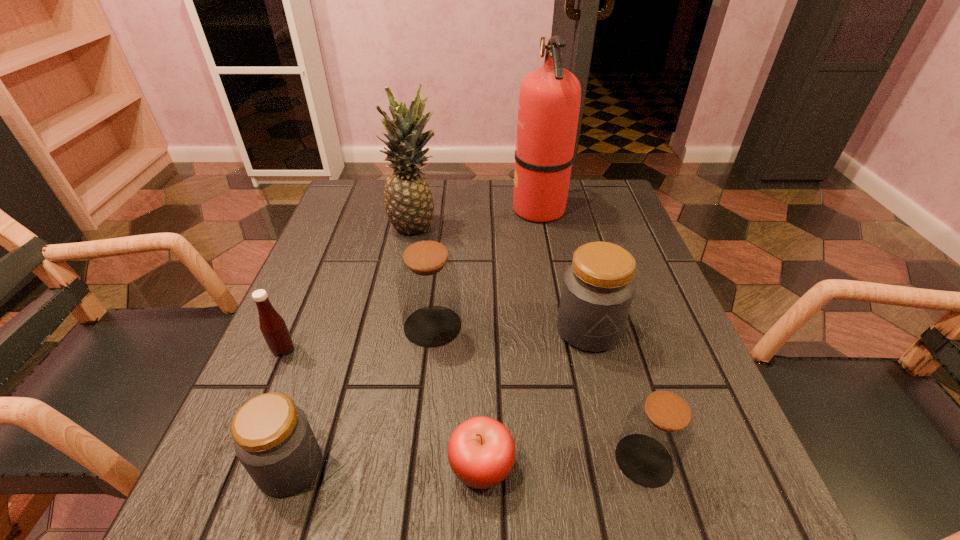
Identify the location of vacant space at the near left corner of the desktop. This screenshot has height=540, width=960. (233, 531).

In the image, there is a desktop. Where is `vacant area at the far right corner`? vacant area at the far right corner is located at coordinates (613, 206).

Image resolution: width=960 pixels, height=540 pixels. Find the location of `free space at the near right corner of the desktop`. free space at the near right corner of the desktop is located at coordinates (753, 509).

Identify the location of unoccupied area between the green pineapple and the right brown jar. The width and height of the screenshot is (960, 540). (530, 342).

You are a GUI agent. You are given a task and a screenshot of the screen. Output one action in this format:
    pyautogui.click(x=<x>, y=<y>)
    Task: Click on the free area in between the apple and the right gray jar
    Image resolution: width=960 pixels, height=540 pixels.
    Given the screenshot: What is the action you would take?
    pyautogui.click(x=535, y=398)

Image resolution: width=960 pixels, height=540 pixels. I want to click on vacant space in between the red apple and the pineapple, so click(x=448, y=346).

Identify the location of free space between the pineapple and the shortest object. This screenshot has width=960, height=540. (448, 346).

You are a GUI agent. You are given a task and a screenshot of the screen. Output one action in this format:
    pyautogui.click(x=<x>, y=<y>)
    Task: Click on the empty location between the farther gray jar and the red fire extinguisher
    This screenshot has width=960, height=540.
    Given the screenshot: What is the action you would take?
    pyautogui.click(x=564, y=269)

Image resolution: width=960 pixels, height=540 pixels. Find the location of `free point between the green pineapple and the shortest object`. free point between the green pineapple and the shortest object is located at coordinates (448, 346).

Identify which object is located as the second nearest to the second jar from left to right. Please provide its 2D coordinates. Your answer should be formatted as a tuple, i.e. [(x, y)], where the tuple contains the x and y coordinates of a point satisfying the conditions above.

[(598, 288)]